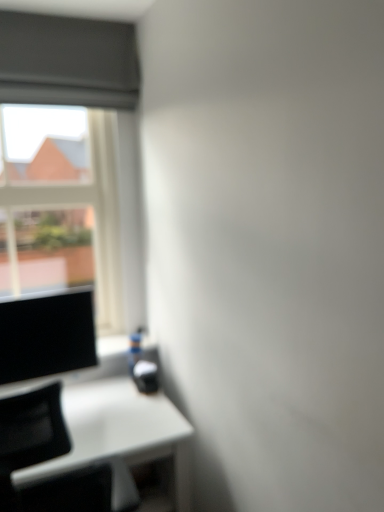
At what (x,y) coordinates should I click in order to perform the action: click on transparent glass window at upper left. Please return your answer as a coordinate pair (x, y). This screenshot has width=384, height=512. Looking at the image, I should click on (73, 159).

This screenshot has height=512, width=384. Find the location of `white glossy table at lower left`. white glossy table at lower left is located at coordinates (120, 432).

Who is bigger, white glossy table at lower left or matte black monitor at left?

Bigger between the two is white glossy table at lower left.

Can you see white glossy table at lower left touching matte black monitor at left?

No, white glossy table at lower left is not next to matte black monitor at left.

Based on the photo, considering the sizes of white glossy table at lower left and matte black monitor at left in the image, is white glossy table at lower left wider or thinner than matte black monitor at left?

Clearly, white glossy table at lower left has more width compared to matte black monitor at left.

Is matte black monitor at left at the back of white glossy table at lower left?

No, matte black monitor at left is not at the back of white glossy table at lower left.

Where is `computer screen that appears on the right of transparent glass window at upper left`? The image size is (384, 512). computer screen that appears on the right of transparent glass window at upper left is located at coordinates (47, 335).

Considering the positions of objects transparent glass window at upper left and matte black monitor at left in the image provided, who is more to the right, transparent glass window at upper left or matte black monitor at left?

matte black monitor at left is more to the right.

How distant is transparent glass window at upper left from matte black monitor at left?

21.12 inches.

Is transparent glass window at upper left facing towards matte black monitor at left?

Yes, transparent glass window at upper left is aimed at matte black monitor at left.

Is white glossy table at lower left spatially inside transparent glass window at upper left, or outside of it?

white glossy table at lower left exists outside the volume of transparent glass window at upper left.

Is white glossy table at lower left aimed at transparent glass window at upper left?

No.

Considering the relative sizes of white glossy table at lower left and transparent glass window at upper left in the image provided, is white glossy table at lower left shorter than transparent glass window at upper left?

Indeed, white glossy table at lower left has a lesser height compared to transparent glass window at upper left.

Image resolution: width=384 pixels, height=512 pixels. I want to click on window that is on the left side of white glossy table at lower left, so click(x=73, y=159).

Is transparent glass window at upper left surrounding white glossy table at lower left?

No, white glossy table at lower left is not inside transparent glass window at upper left.

Is transparent glass window at upper left not close to white glossy table at lower left?

No, transparent glass window at upper left is not far from white glossy table at lower left.

Based on the photo, is transparent glass window at upper left positioned before white glossy table at lower left?

No, transparent glass window at upper left is further to the viewer.

Which of these two, matte black monitor at left or transparent glass window at upper left, is wider?

Wider between the two is transparent glass window at upper left.

Looking at this image, which is closer to the camera, (x=17, y=318) or (x=40, y=159)?

Point (x=17, y=318) is positioned closer to the camera compared to point (x=40, y=159).

Who is taller, matte black monitor at left or transparent glass window at upper left?

transparent glass window at upper left.

From the image's perspective, which is below, matte black monitor at left or transparent glass window at upper left?

matte black monitor at left appears lower in the image.

Is matte black monitor at left located outside white glossy table at lower left?

Indeed, matte black monitor at left is completely outside white glossy table at lower left.

Would you say matte black monitor at left is to the left or to the right of white glossy table at lower left in the picture?

matte black monitor at left is to the left of white glossy table at lower left.

Consider the image. From a real-world perspective, does matte black monitor at left stand above white glossy table at lower left?

Indeed, from a real-world perspective, matte black monitor at left stands above white glossy table at lower left.

Could you tell me if matte black monitor at left is turned towards white glossy table at lower left?

No, matte black monitor at left is not facing towards white glossy table at lower left.

I want to click on computer screen above the white glossy table at lower left (from a real-world perspective), so click(x=47, y=335).

Image resolution: width=384 pixels, height=512 pixels. I want to click on window located behind the matte black monitor at left, so click(73, 159).

When comparing their distances from transparent glass window at upper left, does matte black monitor at left or white glossy table at lower left seem further?

The object further to transparent glass window at upper left is white glossy table at lower left.

From the image, which object appears to be farther from transparent glass window at upper left, white glossy table at lower left or matte black monitor at left?

The object further to transparent glass window at upper left is white glossy table at lower left.

Which object lies further to the anchor point white glossy table at lower left, matte black monitor at left or transparent glass window at upper left?

Among the two, transparent glass window at upper left is located further to white glossy table at lower left.

Consider the image. Based on their spatial positions, is white glossy table at lower left or transparent glass window at upper left closer to matte black monitor at left?

white glossy table at lower left.

When comparing their distances from matte black monitor at left, does transparent glass window at upper left or white glossy table at lower left seem closer?

Based on the image, white glossy table at lower left appears to be nearer to matte black monitor at left.

Based on their spatial positions, is transparent glass window at upper left or matte black monitor at left further from white glossy table at lower left?

transparent glass window at upper left lies further to white glossy table at lower left than the other object.

Locate an element on the screen. computer screen between transparent glass window at upper left and white glossy table at lower left in the up-down direction is located at coordinates (47, 335).